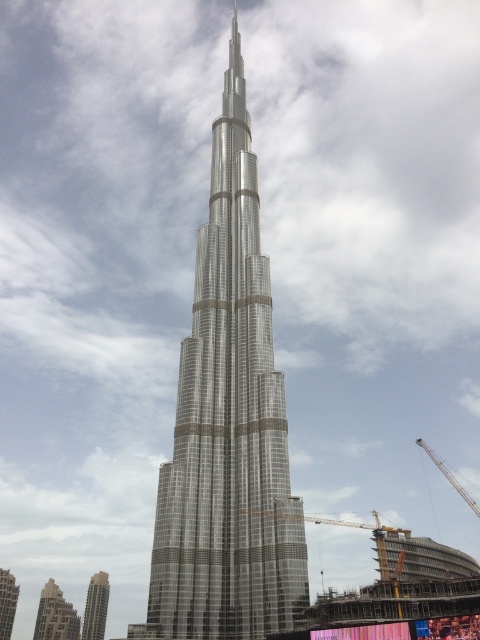
Which is below, metallic yellow crane at lower center or silver glass skyscraper at lower left?

Positioned lower is silver glass skyscraper at lower left.

Is the position of metallic yellow crane at lower center less distant than that of silver glass skyscraper at lower left?

Yes, metallic yellow crane at lower center is closer to the viewer.

This screenshot has height=640, width=480. I want to click on metallic yellow crane at lower center, so pyautogui.click(x=356, y=528).

Does metallic yellow crane at lower center appear over silver metallic skyscraper at center?

Correct, metallic yellow crane at lower center is located above silver metallic skyscraper at center.

Based on the photo, between metallic yellow crane at lower center and silver metallic skyscraper at center, which one is positioned lower?

silver metallic skyscraper at center

The height and width of the screenshot is (640, 480). Find the location of `metallic yellow crane at lower center`. metallic yellow crane at lower center is located at coordinates (356, 528).

Between silver metallic tower at center and silver glass skyscraper at lower left, which one is positioned lower?

silver glass skyscraper at lower left is lower down.

Based on the photo, can you confirm if silver metallic tower at center is taller than silver glass skyscraper at lower left?

Correct, silver metallic tower at center is much taller as silver glass skyscraper at lower left.

Between point (225, 80) and point (95, 577), which one is positioned in front?

Point (95, 577) is in front.

I want to click on silver metallic tower at center, so click(x=228, y=426).